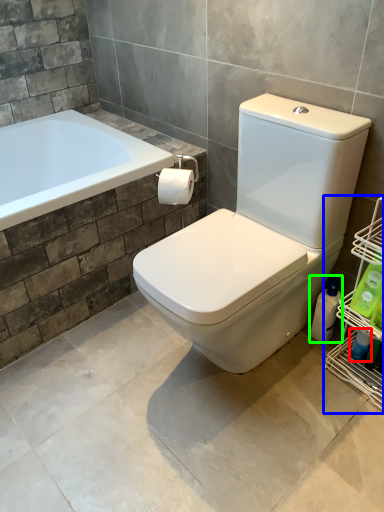
Question: Which object is positioned farthest from cleaning product (highlighted by a red box)? Select from shelf (highlighted by a blue box) and cleaning product (highlighted by a green box).

Choices:
 (A) shelf
 (B) cleaning product

Answer: (A)